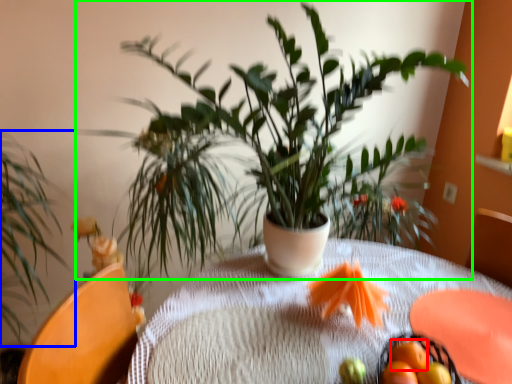
Question: Based on their relative distances, which object is nearer to tangerine (highlighted by a red box)? Choose from houseplant (highlighted by a blue box) and houseplant (highlighted by a green box).

Choices:
 (A) houseplant
 (B) houseplant

Answer: (B)